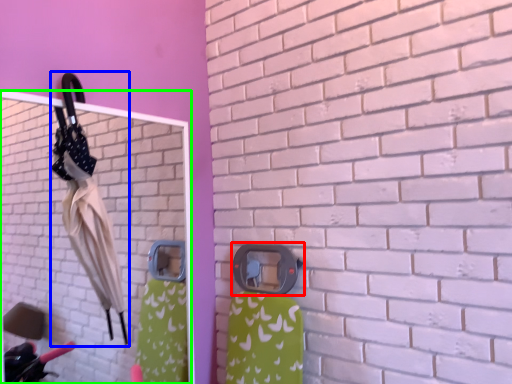
Question: Which object is the closest to the door handle (highlighted by a red box)? Choose among these: umbrella (highlighted by a blue box) or mirror (highlighted by a green box).

Choices:
 (A) umbrella
 (B) mirror

Answer: (A)